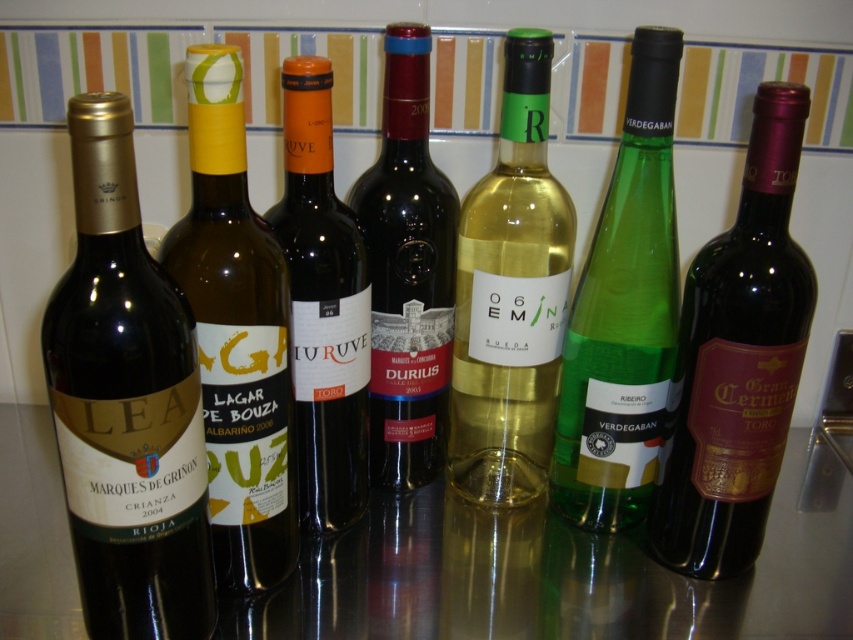
You are arranging wine bottles on a table and need to place a new bottle exactly where the matte gold wine bottle at left is currently positioned. According to the coordinates provided, where should you place the new bottle?

The new bottle should be placed at coordinates point (126, 403) where the matte gold wine bottle at left is currently located.

You are a photographer taking a picture of the wine bottles. You want to focus on the point that is closer to the camera. Which point should you choose between point (352, 563) and point (198, 467)?

Point (198, 467) is closer to the camera than point (352, 563), so you should choose point (198, 467) to focus on.

You are arranging a wine display and want to place a decorative item on the glossy glass table at center. However, you notice the matte gold wine bottle at left. Where should you place the item to avoid it falling off the table?

You should place the decorative item away from the edge nearest the matte gold wine bottle at left, as the glossy glass table at center is positioned under it, meaning the bottle is hanging over that edge.